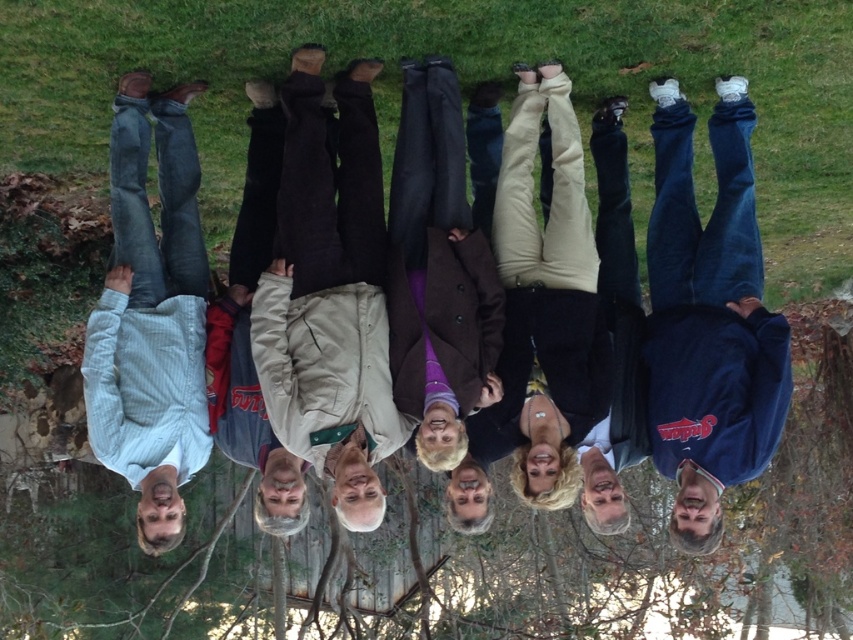
You are taking a photo of the group of people in the autumn setting. You want to ensure the green grass at center and the blue fleece jacket at lower right are both in focus. Which object should you place the focus point closer to, considering their positions?

The green grass at center is positioned on the left side of the blue fleece jacket at lower right. To ensure both are in focus, the focus point should be placed closer to the green grass at center since it is farther from the camera compared to the blue fleece jacket at lower right.

You are standing at the origin point in the image. Which direction should you move to reach the green grass at center?

The green grass at center is located at point [465,88], so you should move towards the lower right direction from the origin point.